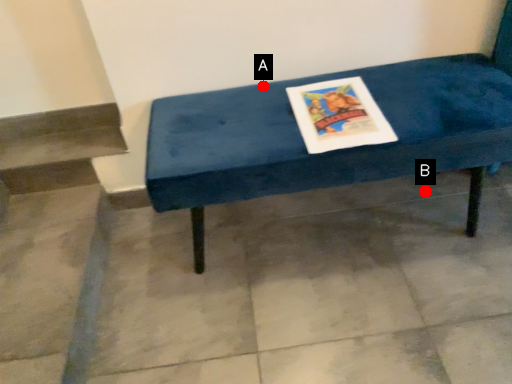
Question: Two points are circled on the image, labeled by A and B beside each circle. Which point is closer to the camera?

Choices:
 (A) A is closer
 (B) B is closer

Answer: (A)